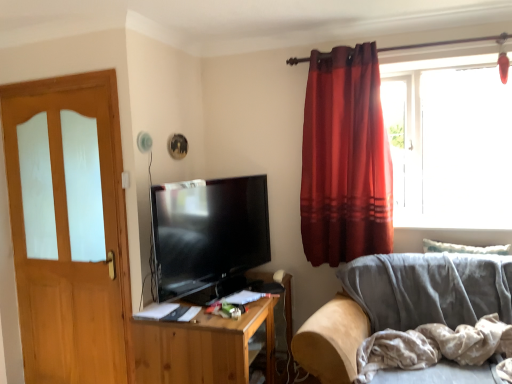
Locate an element on the screen. Image resolution: width=512 pixels, height=384 pixels. blank space situated above light brown wood door at left (from a real-world perspective) is located at coordinates (56, 75).